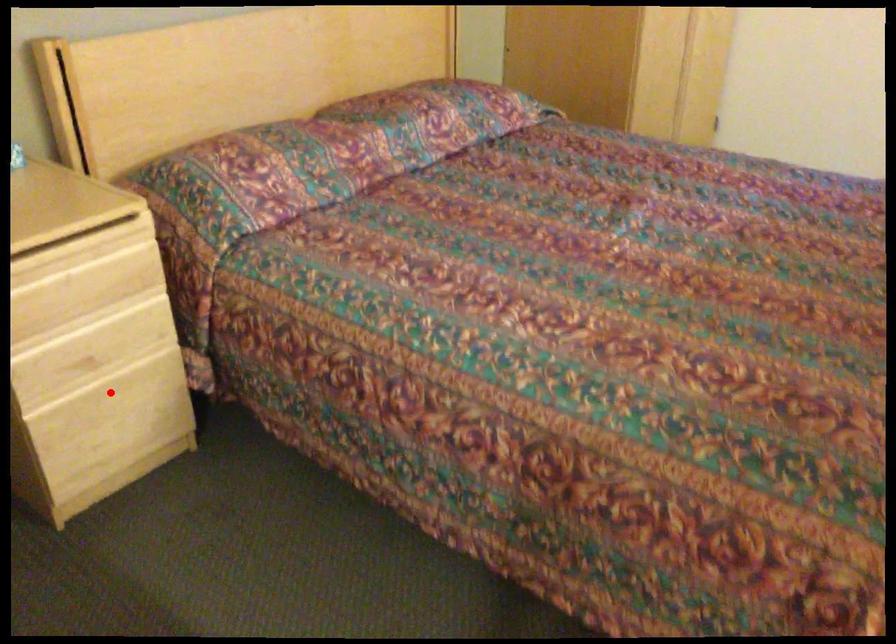
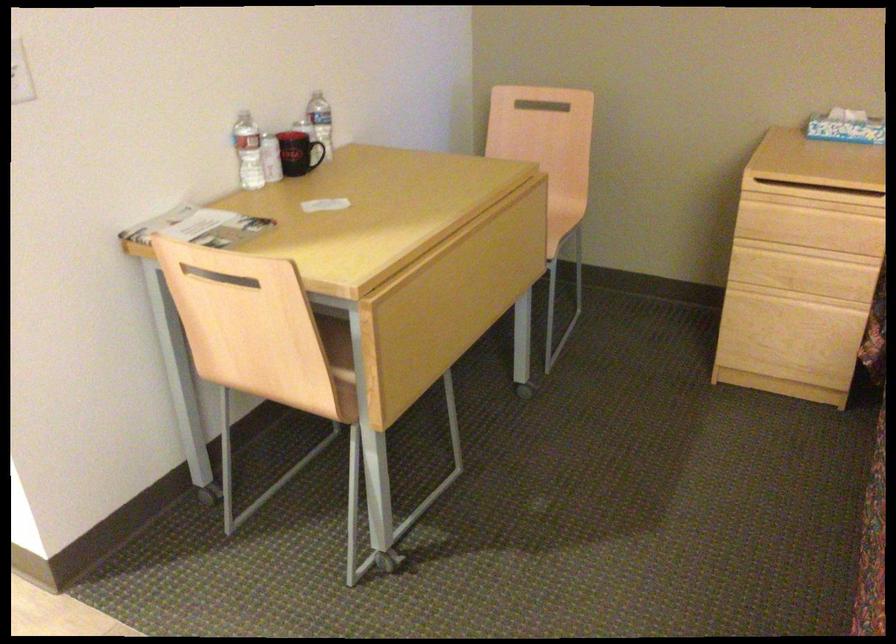
Where in the second image is the point corresponding to the highlighted location from the first image?

(790, 313)